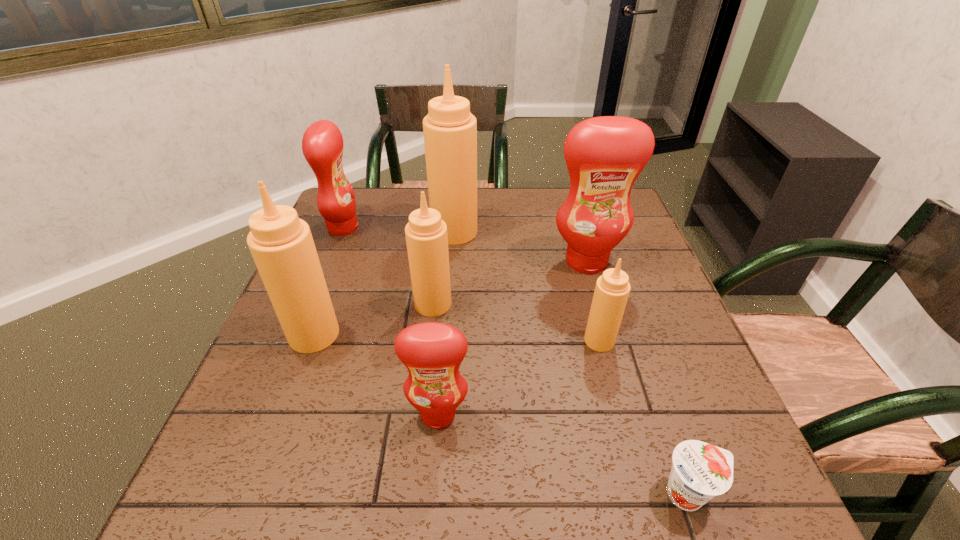
Identify the location of the smallest tan condiment. (612, 289).

Find the location of a particular element. This screenshot has width=960, height=540. yogurt is located at coordinates (700, 471).

Image resolution: width=960 pixels, height=540 pixels. Identify the location of the nearest object. (700, 471).

Locate an element on the screen. vacant space located on the right of the farthest tan condiment is located at coordinates (551, 232).

Locate an element on the screen. This screenshot has height=540, width=960. blank area located on the label side of the biggest red condiment is located at coordinates (614, 358).

What are the coordinates of `vacant area situated on the right of the second biggest tan condiment` in the screenshot? It's located at (394, 334).

Where is `free region located on the front of the third biggest tan condiment`? free region located on the front of the third biggest tan condiment is located at coordinates (419, 429).

This screenshot has width=960, height=540. What are the coordinates of `free region located on the label side of the second smallest red condiment` in the screenshot? It's located at (397, 228).

The width and height of the screenshot is (960, 540). In order to click on free region located on the label side of the nearest condiment in this screenshot , I will do `click(434, 470)`.

The height and width of the screenshot is (540, 960). In order to click on free space located on the front of the rightmost tan condiment in this screenshot , I will do `click(634, 469)`.